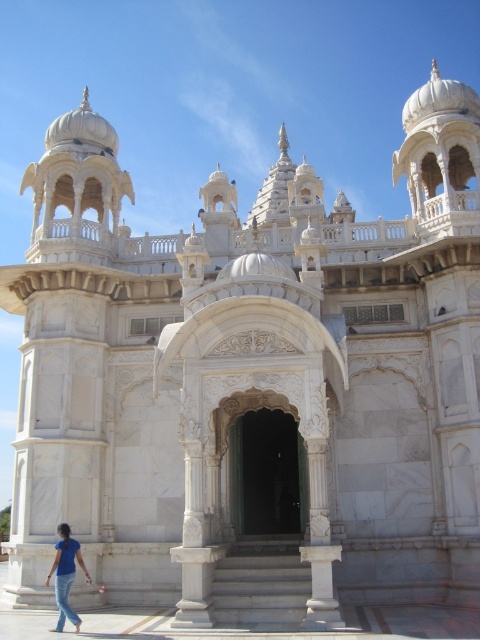
Based on the photo, you are a photographer planning to take a photo of the white marble arch at center and the blue denim jeans at lower left. Which object should you focus on first if you want to capture both in a single frame without moving the camera?

You should focus on the white marble arch at center first because it is larger in size than the blue denim jeans at lower left, so it will require more attention in the frame to ensure it is properly captured.

You are standing at the entrance of the grand building and see the point marked at coordinates (266, 474). What does this point indicate?

The point at coordinates (266, 474) marks the white marble arch at center.

You are standing in front of a grand white marble building with a central arch. If you want to take a photo that captures the entire white marble arch at center without any cropping, would you need to move closer or farther away from it?

The white marble arch at center is 54.07 meters from camera. To capture the entire arch without cropping, you would need to move farther away from it to ensure the entire structure fits within the camera frame.